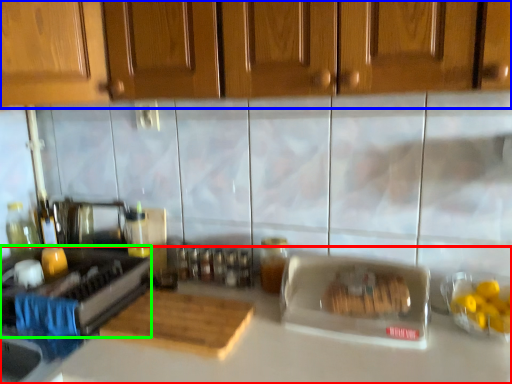
Question: Estimate the real-world distances between objects in this image. Which object is closer to countertop (highlighted by a red box), cabinetry (highlighted by a blue box) or appliance (highlighted by a green box)?

Choices:
 (A) cabinetry
 (B) appliance

Answer: (B)